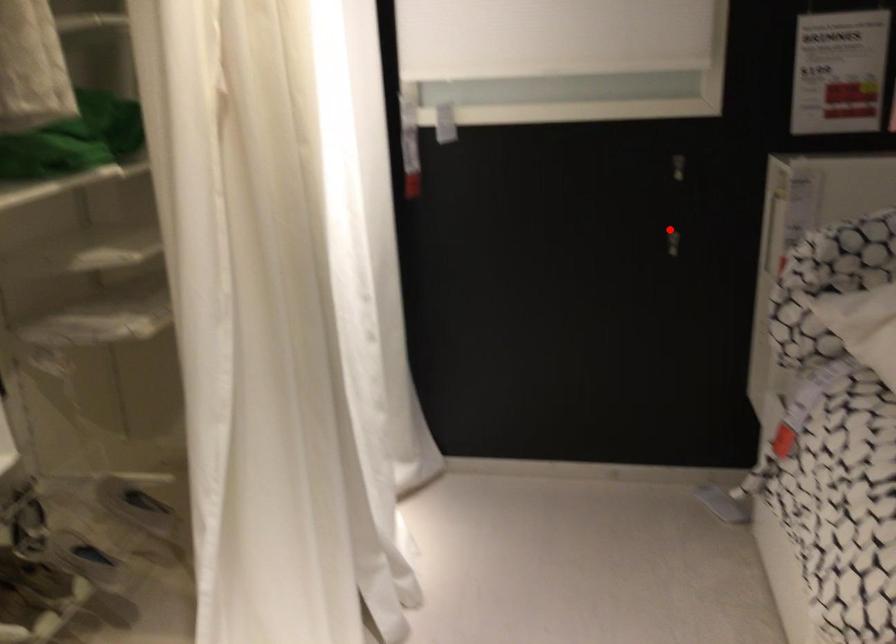
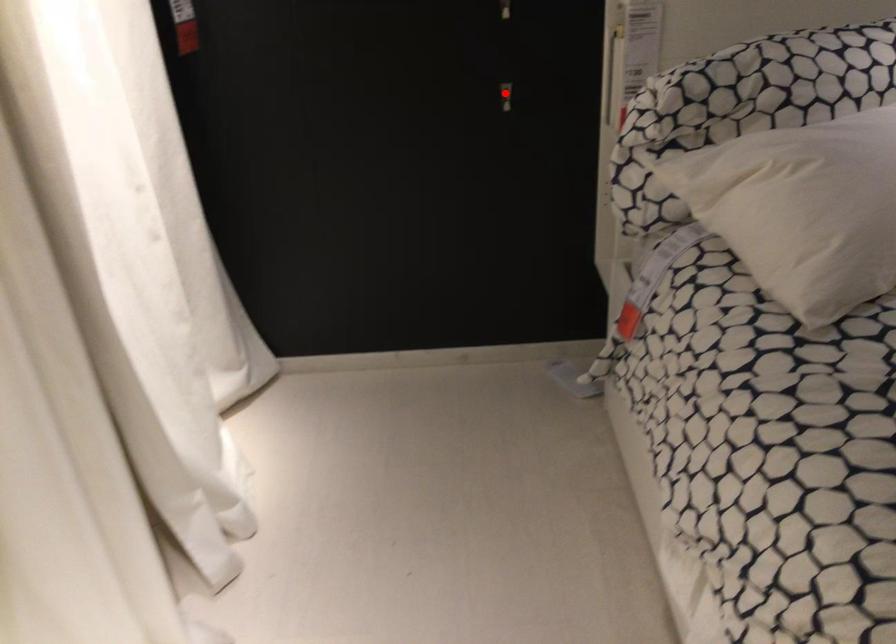
Looking at this image, I am providing you with two images of the same scene from different viewpoints. A red point is marked on the first image and another point is marked on the second image. Is the red point in image1 aligned with the point shown in image2?

Yes